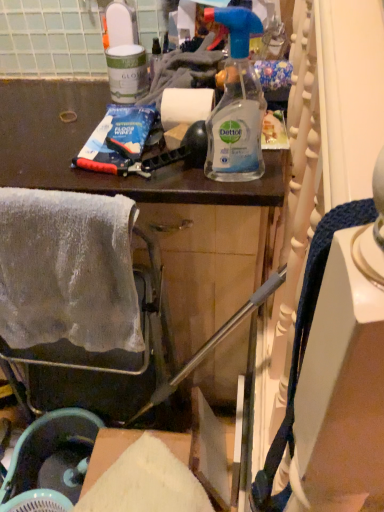
Question: Are clear plastic spray bottle at center, the first bottle viewed from the front, and white glossy paint can at upper left, marked as the 2th bottle in a bottom-to-top arrangement, beside each other?

Choices:
 (A) no
 (B) yes

Answer: (A)

Question: Is clear plastic spray bottle at center, which is counted as the second bottle, starting from the back, oriented away from white glossy paint can at upper left, marked as the 2th bottle in a bottom-to-top arrangement?

Choices:
 (A) yes
 (B) no

Answer: (B)

Question: Is clear plastic spray bottle at center, acting as the 2th bottle starting from the left, surrounding white glossy paint can at upper left, marked as the 2th bottle in a bottom-to-top arrangement?

Choices:
 (A) no
 (B) yes

Answer: (A)

Question: From a real-world perspective, does clear plastic spray bottle at center, the first bottle viewed from the front, sit lower than white glossy paint can at upper left, marked as the 2th bottle in a bottom-to-top arrangement?

Choices:
 (A) yes
 (B) no

Answer: (B)

Question: Does clear plastic spray bottle at center, marked as the 1th bottle in a right-to-left arrangement, have a lesser height compared to white glossy paint can at upper left, the 2th bottle from the right?

Choices:
 (A) yes
 (B) no

Answer: (B)

Question: Would you say white matte paper towel at center is to the left or to the right of white fluffy towel at left in the picture?

Choices:
 (A) right
 (B) left

Answer: (A)

Question: From a real-world perspective, is white matte paper towel at center above or below white fluffy towel at left?

Choices:
 (A) below
 (B) above

Answer: (B)

Question: From the image's perspective, is white matte paper towel at center located above or below white fluffy towel at left?

Choices:
 (A) below
 (B) above

Answer: (B)

Question: Relative to white fluffy towel at left, is white matte paper towel at center in front or behind?

Choices:
 (A) front
 (B) behind

Answer: (B)

Question: Is white matte paper towel at center in front of or behind clear plastic spray bottle at center, the first bottle viewed from the front, in the image?

Choices:
 (A) front
 (B) behind

Answer: (B)

Question: Is white matte paper towel at center inside or outside of clear plastic spray bottle at center, the first bottle in the bottom-to-top sequence?

Choices:
 (A) outside
 (B) inside

Answer: (A)

Question: From a real-world perspective, is white matte paper towel at center positioned above or below clear plastic spray bottle at center, the first bottle in the bottom-to-top sequence?

Choices:
 (A) below
 (B) above

Answer: (A)

Question: In terms of size, does white matte paper towel at center appear bigger or smaller than clear plastic spray bottle at center, placed as the second bottle when sorted from top to bottom?

Choices:
 (A) small
 (B) big

Answer: (A)

Question: Considering the positions of white matte paper towel at center and matte black cabinet at upper center in the image, is white matte paper towel at center wider or thinner than matte black cabinet at upper center?

Choices:
 (A) thin
 (B) wide

Answer: (A)

Question: From a real-world perspective, is white matte paper towel at center positioned above or below matte black cabinet at upper center?

Choices:
 (A) above
 (B) below

Answer: (A)